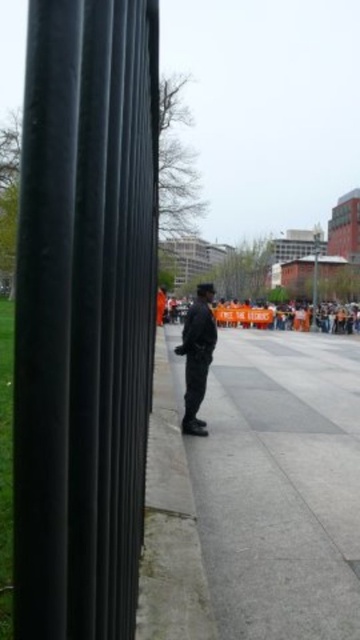
The height and width of the screenshot is (640, 360). What do you see at coordinates (83, 316) in the screenshot?
I see `black matte pole at left` at bounding box center [83, 316].

Measure the distance between point (52, 381) and camera.

The distance of point (52, 381) from camera is 21.47 inches.

The image size is (360, 640). Find the location of `black matte pole at left`. black matte pole at left is located at coordinates (83, 316).

Can you confirm if gray concrete sidewalk at center is wider than dark gray uniform at center?

Yes, gray concrete sidewalk at center is wider than dark gray uniform at center.

Can you confirm if gray concrete sidewalk at center is bigger than dark gray uniform at center?

Correct, gray concrete sidewalk at center is larger in size than dark gray uniform at center.

Which is behind, point (261, 593) or point (204, 422)?

Point (204, 422)

This screenshot has height=640, width=360. I want to click on gray concrete sidewalk at center, so click(281, 484).

Which is below, black matte pole at left or gray concrete sidewalk at center?

gray concrete sidewalk at center is below.

In the scene shown: Is black matte pole at left smaller than gray concrete sidewalk at center?

Yes, black matte pole at left is smaller than gray concrete sidewalk at center.

This screenshot has height=640, width=360. Describe the element at coordinates (83, 316) in the screenshot. I see `black matte pole at left` at that location.

This screenshot has width=360, height=640. In order to click on black matte pole at left in this screenshot , I will do `click(83, 316)`.